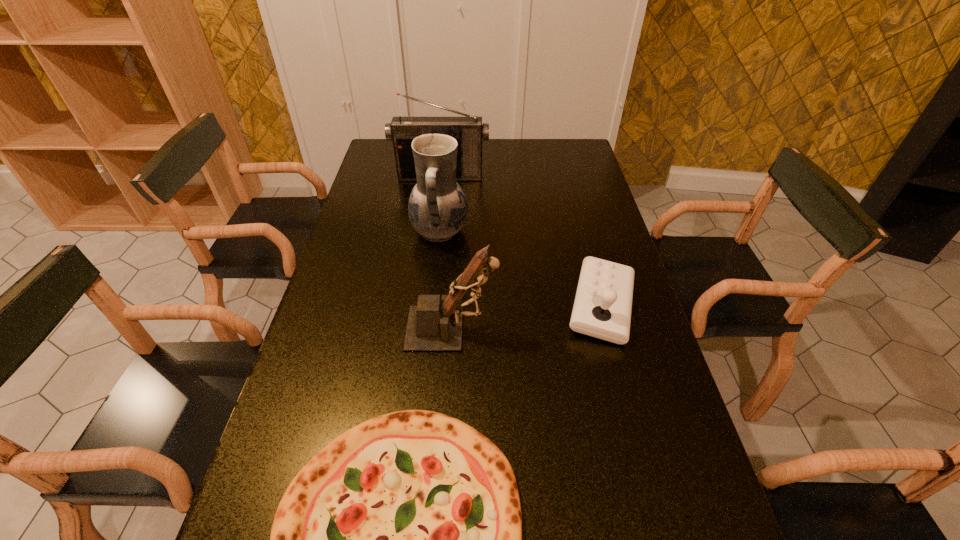
Identify the location of object that is at the right edge. (602, 308).

In the image, there is a desktop. Find the location of `vacant space at the far edge`. vacant space at the far edge is located at coordinates (512, 139).

The width and height of the screenshot is (960, 540). In the image, there is a desktop. Find the location of `vacant area at the left edge`. vacant area at the left edge is located at coordinates (358, 240).

Find the location of `vacant area at the far left corner of the desktop`. vacant area at the far left corner of the desktop is located at coordinates (382, 165).

This screenshot has width=960, height=540. I want to click on vacant space at the far right corner, so click(x=544, y=147).

I want to click on vacant area that lies between the figurine and the farthest object, so click(446, 252).

The image size is (960, 540). I want to click on free space between the rightmost object and the figurine, so click(527, 317).

Where is `vacant area that lies between the second shortest object and the figurine`? Image resolution: width=960 pixels, height=540 pixels. vacant area that lies between the second shortest object and the figurine is located at coordinates (527, 317).

Find the location of a particular element. This screenshot has height=540, width=960. empty space between the pitcher and the joystick is located at coordinates (521, 269).

Find the location of a particular element. The width and height of the screenshot is (960, 540). unoccupied position between the figurine and the fourth tallest object is located at coordinates (527, 317).